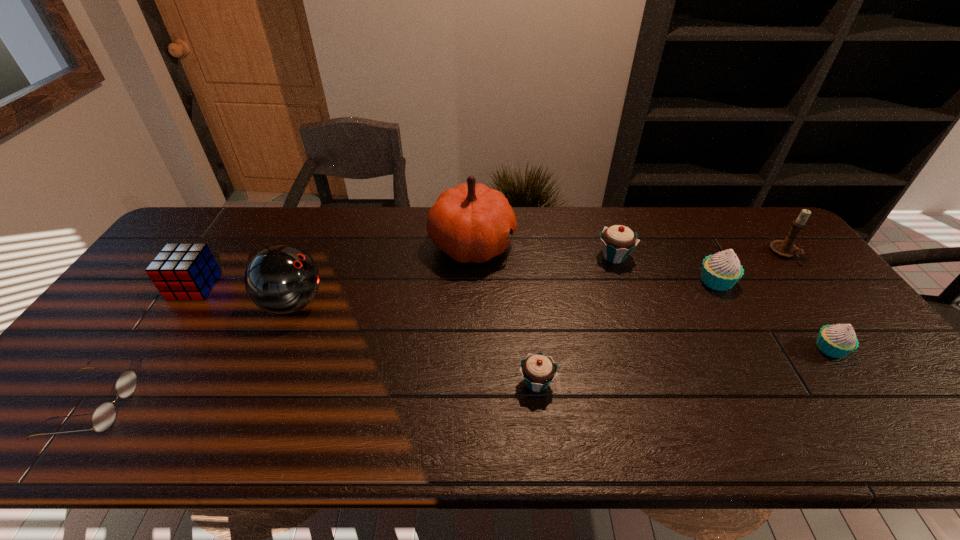
Point out which object is positioned as the fourth nearest to the bigger white cupcake. Please provide its 2D coordinates. Your answer should be formatted as a tuple, i.e. [(x, y)], where the tuple contains the x and y coordinates of a point satisfying the conditions above.

[(471, 222)]

Locate an element on the screen. The image size is (960, 540). object identified as the seventh closest to the fourth object from right to left is located at coordinates (186, 271).

Select which cupcake is the second closest to the bigger teal cupcake. Please provide its 2D coordinates. Your answer should be formatted as a tuple, i.e. [(x, y)], where the tuple contains the x and y coordinates of a point satisfying the conditions above.

[(538, 370)]

Locate which cupcake is the third closest to the bowling ball. Please provide its 2D coordinates. Your answer should be formatted as a tuple, i.e. [(x, y)], where the tuple contains the x and y coordinates of a point satisfying the conditions above.

[(721, 271)]

The height and width of the screenshot is (540, 960). In order to click on vacant area that satisfies the following two spatial constraints: 1. on the front-facing side of the pink pumpkin; 2. on the back side of the seventh object from left to right in this screenshot , I will do `click(471, 281)`.

The height and width of the screenshot is (540, 960). In order to click on free spot that satisfies the following two spatial constraints: 1. on the front-facing side of the tallest object; 2. on the front side of the cube in this screenshot , I will do `click(471, 287)`.

The image size is (960, 540). Identify the location of vacant space that satisfies the following two spatial constraints: 1. on the front side of the leftmost cupcake; 2. on the temples of the shortest object. (540, 408).

Locate an element on the screen. free region that satisfies the following two spatial constraints: 1. on the back side of the red cube; 2. on the right side of the second cupcake from right to left is located at coordinates (198, 281).